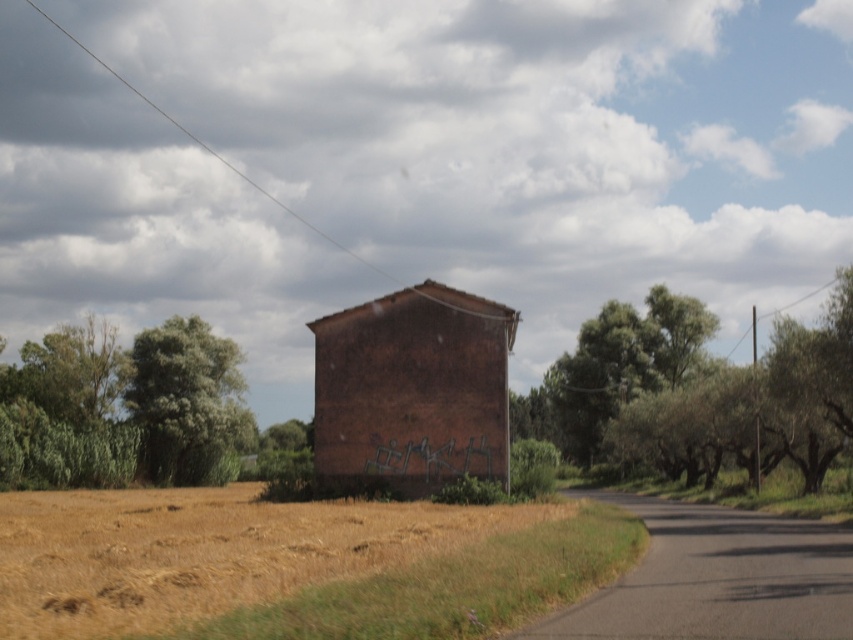
Question: Can you confirm if green leafy tree at right is thinner than green leafy tree at upper right?

Choices:
 (A) no
 (B) yes

Answer: (A)

Question: Which point is closer to the camera taking this photo?

Choices:
 (A) (183, 422)
 (B) (631, 394)

Answer: (A)

Question: Which object is positioned farthest from the green leafy tree at left?

Choices:
 (A) green leafy tree at right
 (B) green leafy tree at upper right

Answer: (B)

Question: Estimate the real-world distances between objects in this image. Which object is farther from the green leafy tree at left?

Choices:
 (A) green leafy tree at upper right
 (B) green leafy tree at right

Answer: (A)

Question: From the image, what is the correct spatial relationship of green leafy tree at upper right in relation to green leafy tree at left?

Choices:
 (A) right
 (B) left

Answer: (A)

Question: Does green leafy tree at right appear over green leafy tree at left?

Choices:
 (A) yes
 (B) no

Answer: (A)